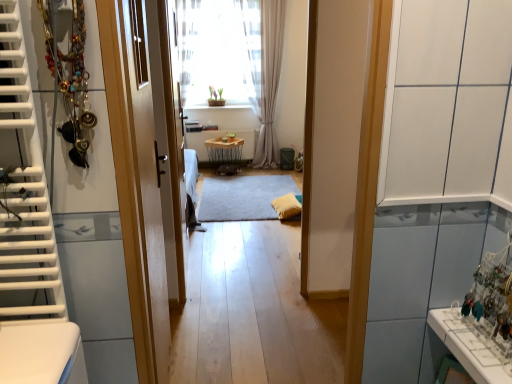
Question: Can you confirm if shiny metallic necklace at left is shorter than gray soft rug at center?

Choices:
 (A) no
 (B) yes

Answer: (A)

Question: Does shiny metallic necklace at left come behind gray soft rug at center?

Choices:
 (A) no
 (B) yes

Answer: (A)

Question: From the image's perspective, would you say shiny metallic necklace at left is shown under gray soft rug at center?

Choices:
 (A) no
 (B) yes

Answer: (A)

Question: Is shiny metallic necklace at left next to gray soft rug at center?

Choices:
 (A) no
 (B) yes

Answer: (A)

Question: Is shiny metallic necklace at left far away from gray soft rug at center?

Choices:
 (A) no
 (B) yes

Answer: (B)

Question: Is shiny metallic necklace at left positioned in front of gray soft rug at center?

Choices:
 (A) no
 (B) yes

Answer: (B)

Question: Is gray soft rug at center to the right of wooden door at center from the viewer's perspective?

Choices:
 (A) yes
 (B) no

Answer: (A)

Question: Is gray soft rug at center not within wooden door at center?

Choices:
 (A) no
 (B) yes

Answer: (B)

Question: Would you consider gray soft rug at center to be distant from wooden door at center?

Choices:
 (A) no
 (B) yes

Answer: (B)

Question: Considering the relative sizes of gray soft rug at center and wooden door at center in the image provided, is gray soft rug at center bigger than wooden door at center?

Choices:
 (A) yes
 (B) no

Answer: (B)

Question: Is wooden door at center completely or partially inside gray soft rug at center?

Choices:
 (A) no
 (B) yes

Answer: (A)

Question: From the image's perspective, would you say gray soft rug at center is shown under wooden door at center?

Choices:
 (A) no
 (B) yes

Answer: (A)

Question: Is white glossy radiator at center at the right side of light beige sheer curtain at center, the 1th curtain viewed from the right?

Choices:
 (A) no
 (B) yes

Answer: (A)